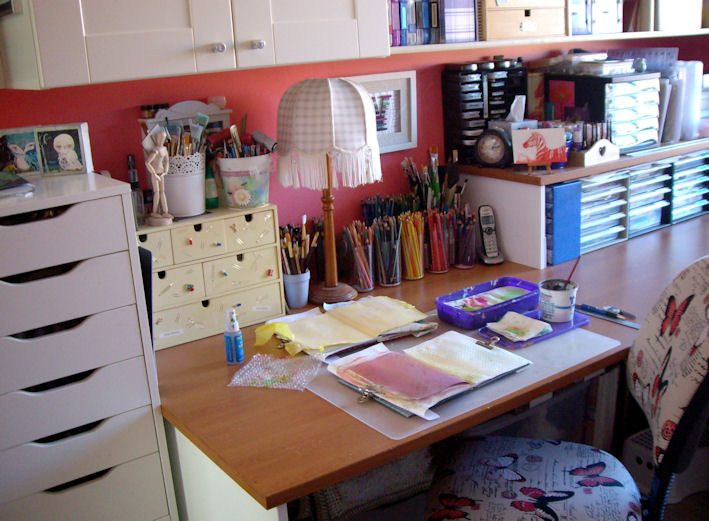
You are a GUI agent. You are given a task and a screenshot of the screen. Output one action in this format:
    pyautogui.click(x=<x>, y=<y>)
    Task: Click on the empty space on top of desk
    
    Given the screenshot: What is the action you would take?
    pyautogui.click(x=296, y=421), pyautogui.click(x=637, y=263)